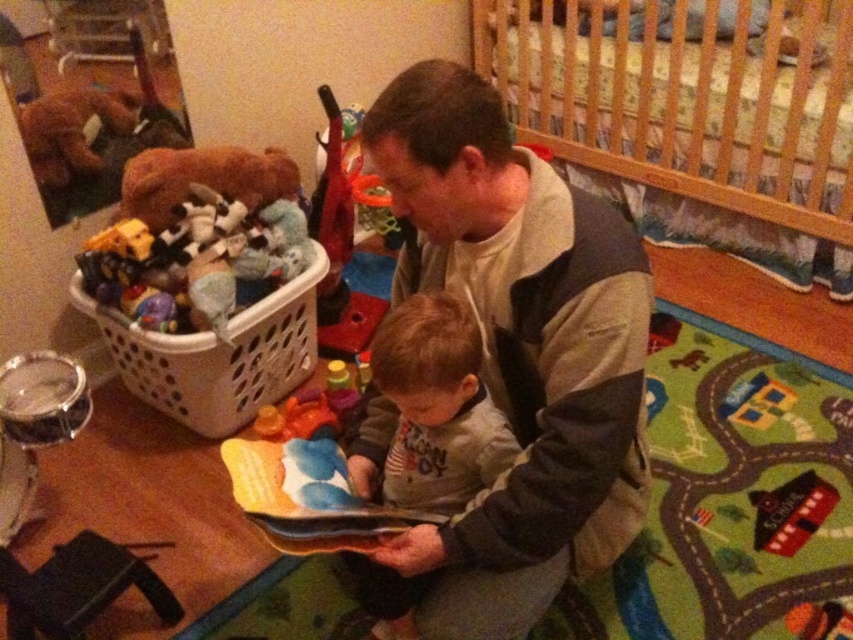
Question: Which point appears farthest from the camera in this image?

Choices:
 (A) (409, 420)
 (B) (399, 566)
 (C) (160, 371)

Answer: (C)

Question: Is wooden crib at upper right above white plastic basket at left?

Choices:
 (A) yes
 (B) no

Answer: (A)

Question: Does gray fleece jacket at center appear on the right side of wooden crib at upper right?

Choices:
 (A) no
 (B) yes

Answer: (A)

Question: Which point appears farthest from the camera in this image?

Choices:
 (A) (283, 387)
 (B) (697, 196)
 (C) (112, 268)
 (D) (368, 604)

Answer: (B)

Question: Is gray fleece jacket at center further to camera compared to gray cotton shirt at center?

Choices:
 (A) no
 (B) yes

Answer: (A)

Question: Based on their relative distances, which object is farther from the soft plush toys at left?

Choices:
 (A) white plastic basket at left
 (B) gray cotton shirt at center
 (C) wooden crib at upper right

Answer: (C)